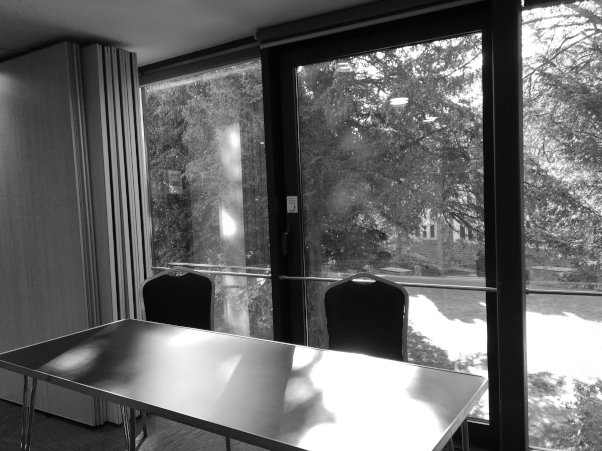
Identify the location of right bottom window glass. This screenshot has height=451, width=602. (547, 341).